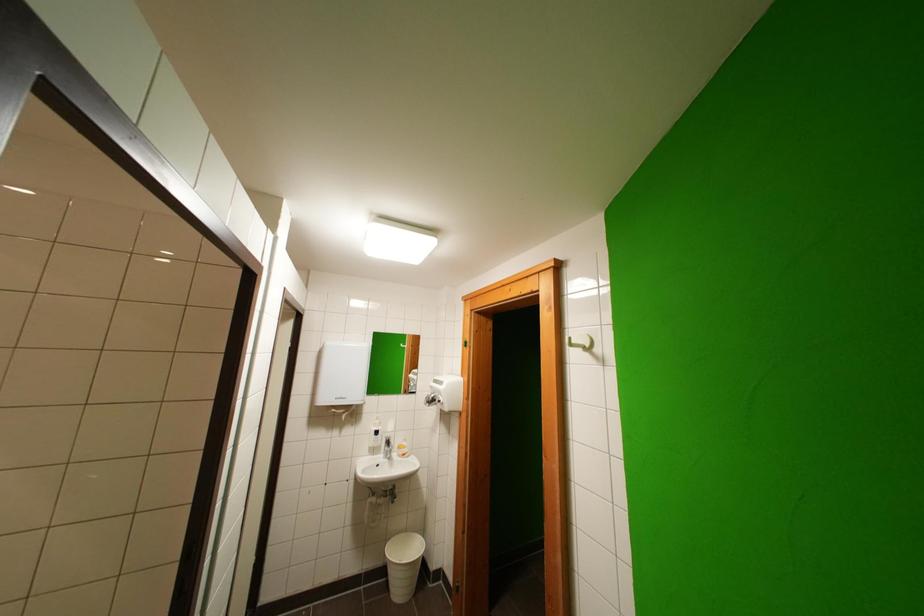
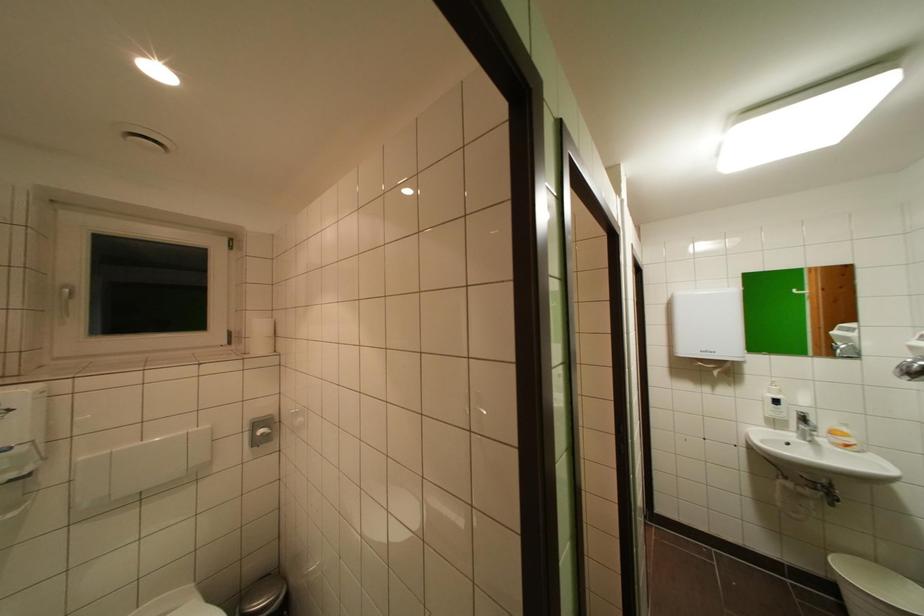
Question: The camera is either moving clockwise (left) or counter-clockwise (right) around the object. The first image is from the beginning of the video and the second image is from the end. Is the camera moving left or right when shooting the video?

Choices:
 (A) Left
 (B) Right

Answer: (B)